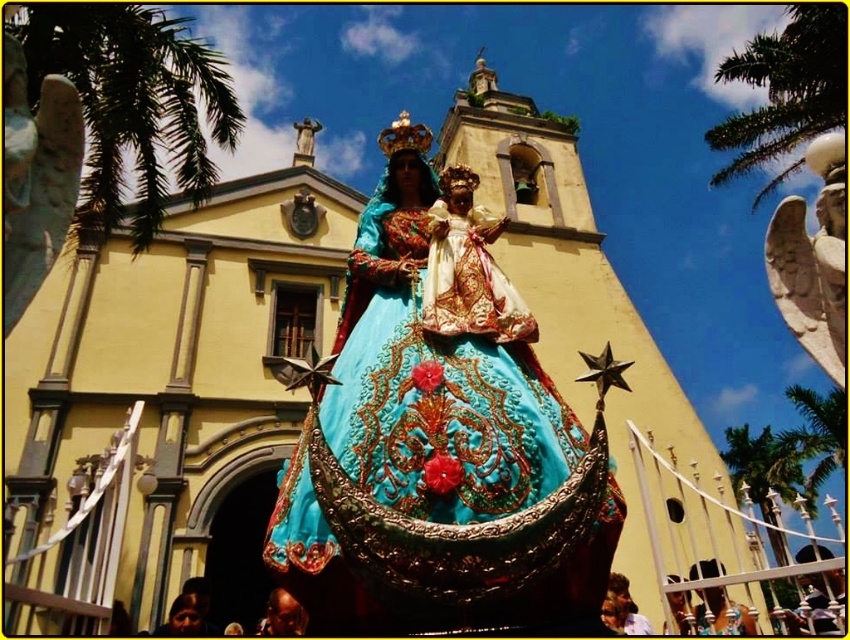
Question: Which object is the closest to the green leafy palm tree at upper center?

Choices:
 (A) green leafy palm tree at lower right
 (B) green leafy palm tree at upper right

Answer: (A)

Question: Is turquoise satin dress at center to the right of green leafy palm tree at lower right from the viewer's perspective?

Choices:
 (A) yes
 (B) no

Answer: (B)

Question: Which point is closer to the camera?

Choices:
 (A) (802, 449)
 (B) (94, 225)
 (C) (778, 177)

Answer: (B)

Question: Among these points, which one is farthest from the camera?

Choices:
 (A) (752, 81)
 (B) (811, 502)
 (C) (782, 442)
 (D) (340, 368)

Answer: (C)

Question: Can you confirm if turquoise satin dress at center is positioned to the left of green leafy palm tree at lower right?

Choices:
 (A) no
 (B) yes

Answer: (B)

Question: Does turquoise satin dress at center have a smaller size compared to green leafy palm tree at left?

Choices:
 (A) no
 (B) yes

Answer: (B)